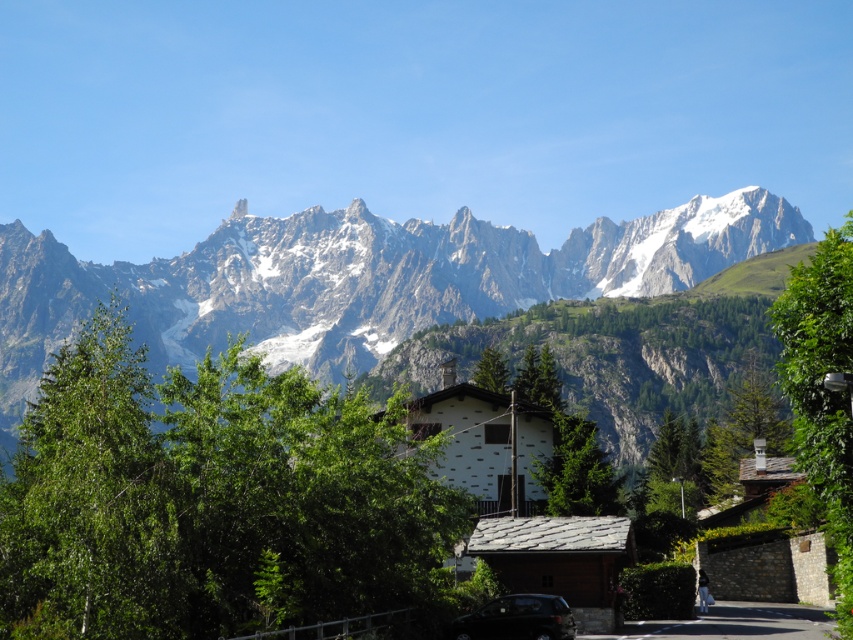
Question: Does gray asphalt road at lower center have a smaller size compared to metallic dark gray car at center?

Choices:
 (A) yes
 (B) no

Answer: (B)

Question: Which object is positioned closest to the metallic dark gray car at center?

Choices:
 (A) white rocky mountain range at upper center
 (B) gray asphalt road at lower center

Answer: (B)

Question: Is white rocky mountain range at upper center wider than metallic dark gray car at center?

Choices:
 (A) yes
 (B) no

Answer: (A)

Question: Among these points, which one is nearest to the camera?

Choices:
 (A) (715, 612)
 (B) (527, 636)

Answer: (B)

Question: Which point is closer to the camera?

Choices:
 (A) gray asphalt road at lower center
 (B) metallic dark gray car at center

Answer: (B)

Question: Can you confirm if white rocky mountain range at upper center is bigger than metallic dark gray car at center?

Choices:
 (A) no
 (B) yes

Answer: (B)